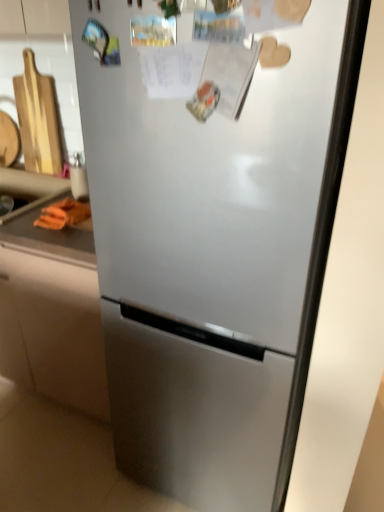
Where is `orange fabric at left`? This screenshot has height=512, width=384. orange fabric at left is located at coordinates (50, 240).

What is the approximate height of orange rubber at lower left?

orange rubber at lower left is 6.21 inches tall.

Locate an element on the screen. This screenshot has width=384, height=512. orange fabric at left is located at coordinates (50, 240).

Visually, is orange fabric at left positioned to the left or to the right of orange rubber at lower left?

orange fabric at left is positioned on orange rubber at lower left's right side.

Is orange fabric at left facing away from orange rubber at lower left?

Yes.

Which is correct: orange fabric at left is inside orange rubber at lower left, or outside of it?

orange fabric at left lies outside orange rubber at lower left.

The height and width of the screenshot is (512, 384). I want to click on sink that appears behind the orange fabric at left, so click(15, 202).

Can you confirm if orange fabric at left is bigger than orange fabric at left?

Correct, orange fabric at left is larger in size than orange fabric at left.

Is orange fabric at left aimed at orange fabric at left?

No, orange fabric at left is not turned towards orange fabric at left.

Is orange fabric at left located outside orange fabric at left?

Yes, orange fabric at left is outside of orange fabric at left.

Which of these two, orange fabric at left or orange fabric at left, stands shorter?

Standing shorter between the two is orange fabric at left.

Is orange rubber at lower left at the right side of orange fabric at left?

No, orange rubber at lower left is not to the right of orange fabric at left.

From the image's perspective, between orange rubber at lower left and orange fabric at left, who is located below?

orange fabric at left appears lower in the image.

Relative to orange fabric at left, is orange rubber at lower left in front or behind?

orange rubber at lower left is positioned farther from the viewer than orange fabric at left.

Can you confirm if orange rubber at lower left is bigger than orange fabric at left?

No.

Considering the sizes of objects orange fabric at left and orange rubber at lower left in the image provided, who is wider, orange fabric at left or orange rubber at lower left?

With larger width is orange rubber at lower left.

From a real-world perspective, between orange fabric at left and orange rubber at lower left, who is vertically higher?

From a 3D spatial view, orange fabric at left is above.

This screenshot has height=512, width=384. What are the coordinates of `sink located on the left of orange fabric at left` in the screenshot? It's located at (15, 202).

Does orange fabric at left have a smaller size compared to orange rubber at lower left?

Yes, orange fabric at left is smaller than orange rubber at lower left.

Is orange rubber at lower left to the left of orange fabric at left from the viewer's perspective?

Correct, you'll find orange rubber at lower left to the left of orange fabric at left.

Find the location of a particular element. The width and height of the screenshot is (384, 512). sink on the left of orange fabric at left is located at coordinates (15, 202).

Is orange rubber at lower left looking in the opposite direction of orange fabric at left?

That's not correct — orange rubber at lower left is not looking away from orange fabric at left.

Which is closer, [0,198] or [88,212]?

Point [0,198] is farther from the camera than point [88,212].

What's the angular difference between orange fabric at left and orange fabric at left's facing directions?

0.0484 degrees.

Locate an element on the screen. counter top below the orange fabric at left (from a real-world perspective) is located at coordinates (50, 240).

Is orange fabric at left surrounded by orange fabric at left?

No, orange fabric at left is not surrounded by orange fabric at left.

Is orange fabric at left wider than orange fabric at left?

No, orange fabric at left is not wider than orange fabric at left.

The image size is (384, 512). In order to click on counter top below the orange rubber at lower left (from the image's perspective) in this screenshot , I will do `click(50, 240)`.

Find the location of a particular element. counter top that is on the left side of orange fabric at left is located at coordinates (50, 240).

Consider the image. Looking at the image, which one is located further to orange rubber at lower left, orange fabric at left or orange fabric at left?

orange fabric at left lies further to orange rubber at lower left than the other object.

From the image, which object appears to be farther from orange fabric at left, orange rubber at lower left or orange fabric at left?

orange rubber at lower left is further to orange fabric at left.

When comparing their distances from orange fabric at left, does orange fabric at left or orange rubber at lower left seem further?

Among the two, orange rubber at lower left is located further to orange fabric at left.

Looking at the image, which one is located closer to orange fabric at left, orange fabric at left or orange rubber at lower left?

Based on the image, orange fabric at left appears to be nearer to orange fabric at left.

Consider the image. When comparing their distances from orange fabric at left, does orange rubber at lower left or orange fabric at left seem further?

Among the two, orange rubber at lower left is located further to orange fabric at left.

Looking at the image, which one is located closer to orange rubber at lower left, orange fabric at left or orange fabric at left?

orange fabric at left.

The image size is (384, 512). In order to click on counter top located between orange rubber at lower left and orange fabric at left in the left-right direction in this screenshot , I will do `click(50, 240)`.